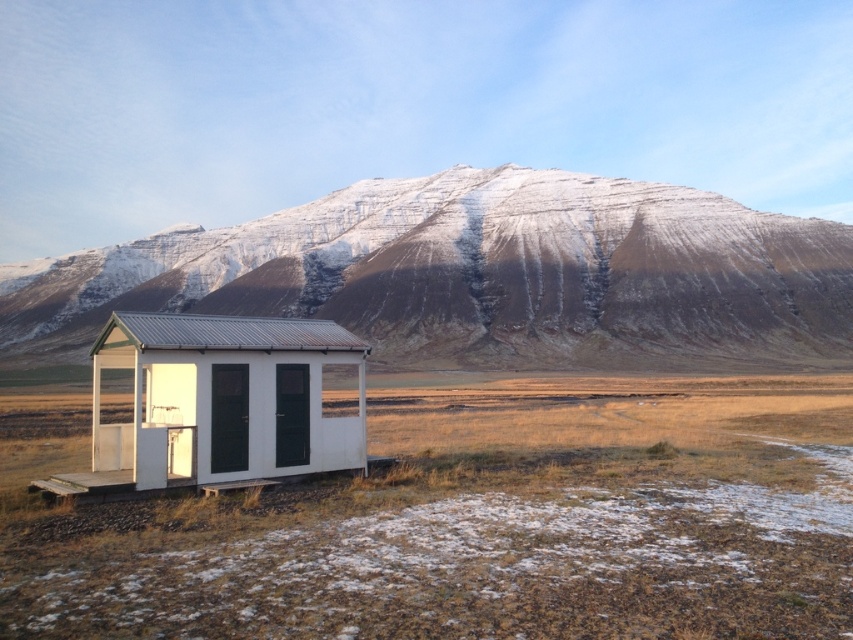
You are standing at the base of the mountain in the image and want to reach the shed. The shed is located at point (175, 241). Can you estimate how far you need to walk to get there?

The distance between point (175, 241) and the viewer is 838.13 feet, so you would need to walk approximately 838.13 feet to reach the shed.

You are standing at the point marked by the coordinates point (479, 524), which is on the lower left of the image. You want to walk towards the shed or cabin in the scene. Which direction should you head to reach it?

Since point (479, 524) is at the lower left and the shed is in the center, you should head towards the upper right direction to reach it.